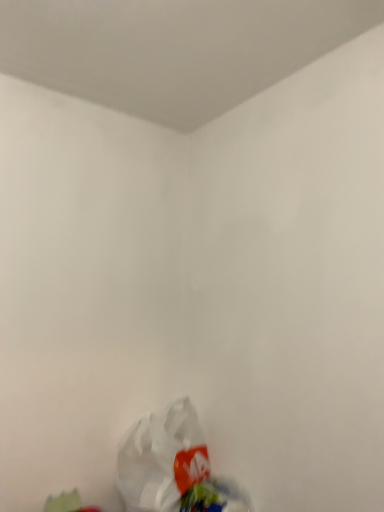
The width and height of the screenshot is (384, 512). Describe the element at coordinates (173, 467) in the screenshot. I see `white matte plastic bag at lower center` at that location.

Locate an element on the screen. white matte plastic bag at lower center is located at coordinates (173, 467).

Locate an element on the screen. This screenshot has height=512, width=384. white matte plastic bag at lower center is located at coordinates point(173,467).